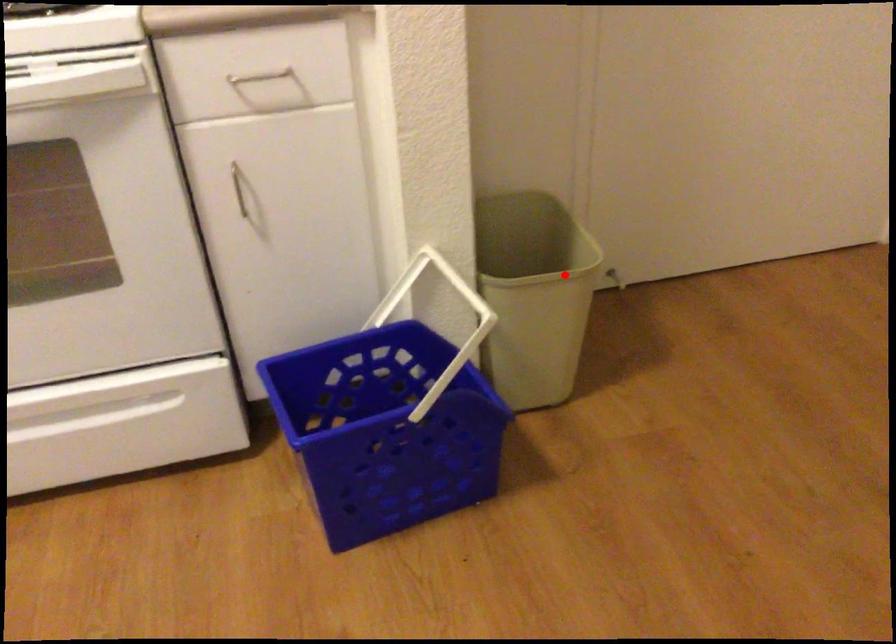
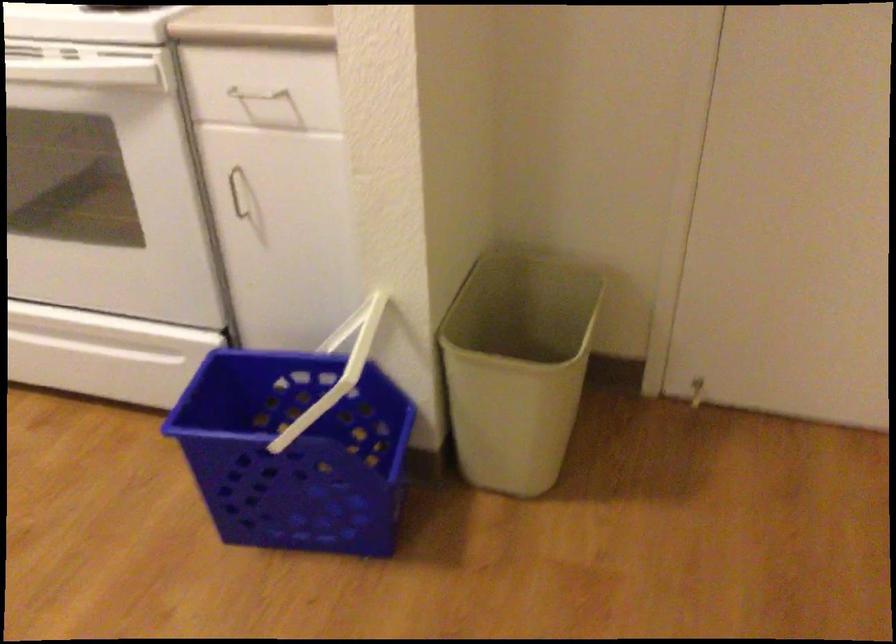
Question: I am providing you with two images of the same scene from different viewpoints. A red point is marked on the first image. At the location where the point appears in image 1, is it still visible in image 2?

Choices:
 (A) Yes
 (B) No

Answer: (A)